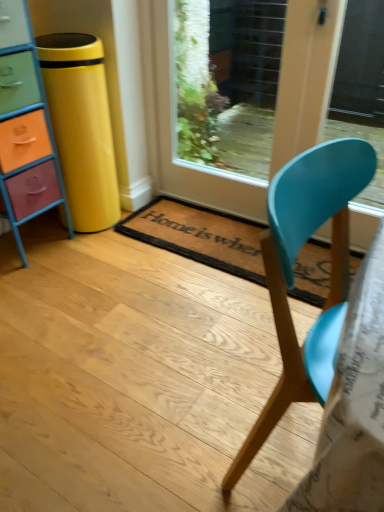
Where is `free space in front of multicolored painted wood chest of drawers at left`? The width and height of the screenshot is (384, 512). free space in front of multicolored painted wood chest of drawers at left is located at coordinates (25, 285).